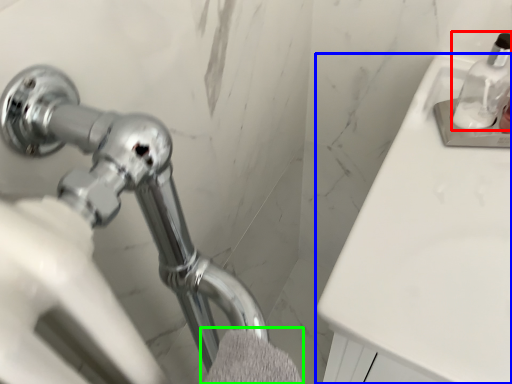
Question: Which is farther away from soap dispenser (highlighted by a red box)? counter top (highlighted by a blue box) or bath towel (highlighted by a green box)?

Choices:
 (A) counter top
 (B) bath towel

Answer: (B)